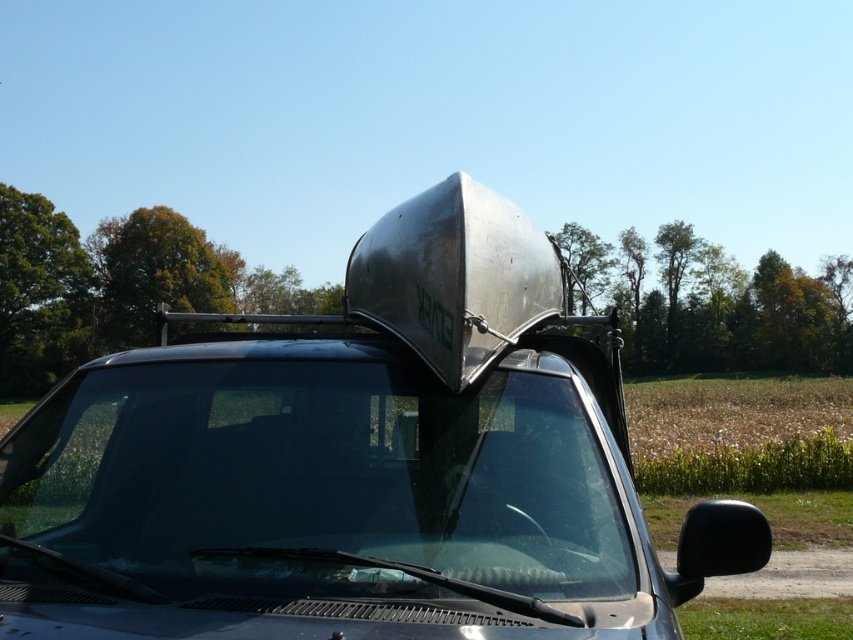
How far apart are transparent glass windshield at center and silver metallic hood at center?

1.45 meters

Which is above, transparent glass windshield at center or silver metallic hood at center?

Positioned higher is silver metallic hood at center.

This screenshot has width=853, height=640. In order to click on transparent glass windshield at center in this screenshot , I will do `click(318, 477)`.

Is metallic silver truck at center bigger than silver metallic hood at center?

Indeed, metallic silver truck at center has a larger size compared to silver metallic hood at center.

Between metallic silver truck at center and silver metallic hood at center, which one is positioned lower?

metallic silver truck at center

Is point (728, 538) more distant than point (415, 253)?

No.

Where is `metallic silver truck at center`? The height and width of the screenshot is (640, 853). metallic silver truck at center is located at coordinates (357, 465).

Does metallic silver truck at center appear on the left side of transparent glass windshield at center?

In fact, metallic silver truck at center is to the right of transparent glass windshield at center.

Does metallic silver truck at center lie behind transparent glass windshield at center?

No.

The width and height of the screenshot is (853, 640). I want to click on metallic silver truck at center, so click(x=357, y=465).